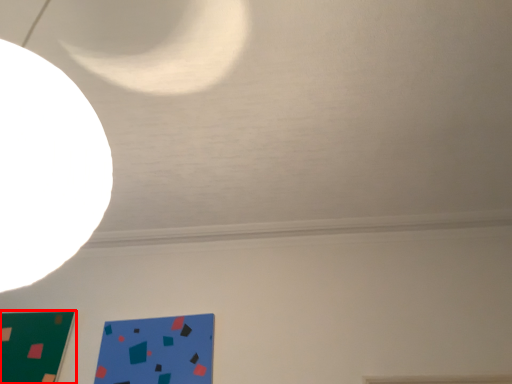
Question: From the image's perspective, what is the correct spatial positioning of rectangle (annotated by the red box) in reference to design?

Choices:
 (A) above
 (B) below

Answer: (B)